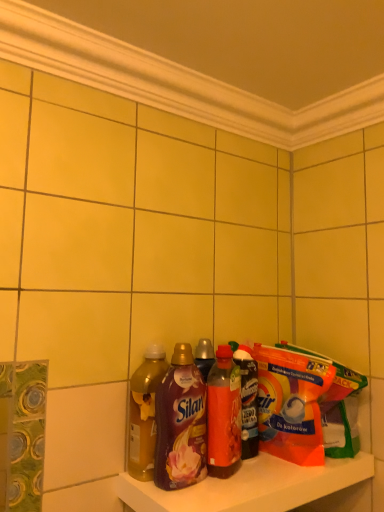
Question: Is orange plastic bag at shelf right thinner than translucent plastic bottle at center, positioned as the 1th bottle in right-to-left order?

Choices:
 (A) no
 (B) yes

Answer: (A)

Question: Is orange plastic bag at shelf right shorter than translucent plastic bottle at center, placed as the 4th bottle when sorted from left to right?

Choices:
 (A) yes
 (B) no

Answer: (A)

Question: Can you confirm if orange plastic bag at shelf right is positioned to the left of translucent plastic bottle at center, placed as the 4th bottle when sorted from left to right?

Choices:
 (A) yes
 (B) no

Answer: (B)

Question: Is orange plastic bag at shelf right touching translucent plastic bottle at center, positioned as the 1th bottle in right-to-left order?

Choices:
 (A) no
 (B) yes

Answer: (B)

Question: Is orange plastic bag at shelf right taller than translucent plastic bottle at center, positioned as the 1th bottle in right-to-left order?

Choices:
 (A) yes
 (B) no

Answer: (B)

Question: Is orange plastic bag at shelf right positioned with its back to translucent plastic bottle at center, positioned as the 1th bottle in right-to-left order?

Choices:
 (A) yes
 (B) no

Answer: (B)

Question: Is translucent amber liquid at shelf center, which is the fourth bottle from right to left, aimed at orange plastic bag at shelf right?

Choices:
 (A) no
 (B) yes

Answer: (A)

Question: Is orange plastic bag at shelf right surrounded by translucent amber liquid at shelf center, placed as the first bottle when sorted from left to right?

Choices:
 (A) yes
 (B) no

Answer: (B)

Question: Does translucent amber liquid at shelf center, which is the fourth bottle from right to left, have a lesser height compared to orange plastic bag at shelf right?

Choices:
 (A) yes
 (B) no

Answer: (B)

Question: Is translucent amber liquid at shelf center, placed as the first bottle when sorted from left to right, not near orange plastic bag at shelf right?

Choices:
 (A) no
 (B) yes

Answer: (A)

Question: Is translucent amber liquid at shelf center, which is the fourth bottle from right to left, outside of orange plastic bag at shelf right?

Choices:
 (A) yes
 (B) no

Answer: (A)

Question: Is translucent amber liquid at shelf center, which is the fourth bottle from right to left, in contact with orange plastic bag at shelf right?

Choices:
 (A) yes
 (B) no

Answer: (B)

Question: Is translucent plastic bottle at center, placed as the 4th bottle when sorted from left to right, surrounded by translucent plastic bottles at lower center?

Choices:
 (A) yes
 (B) no

Answer: (B)